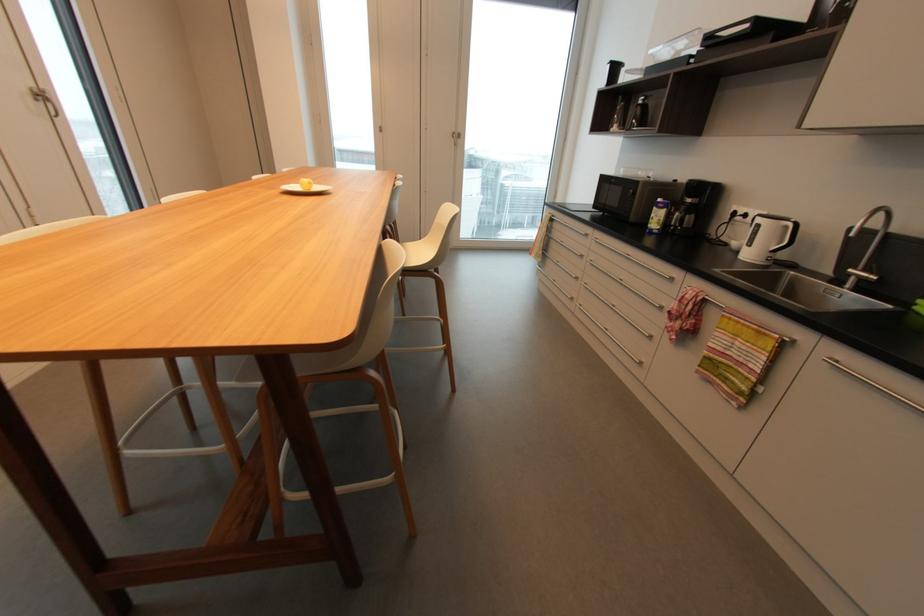
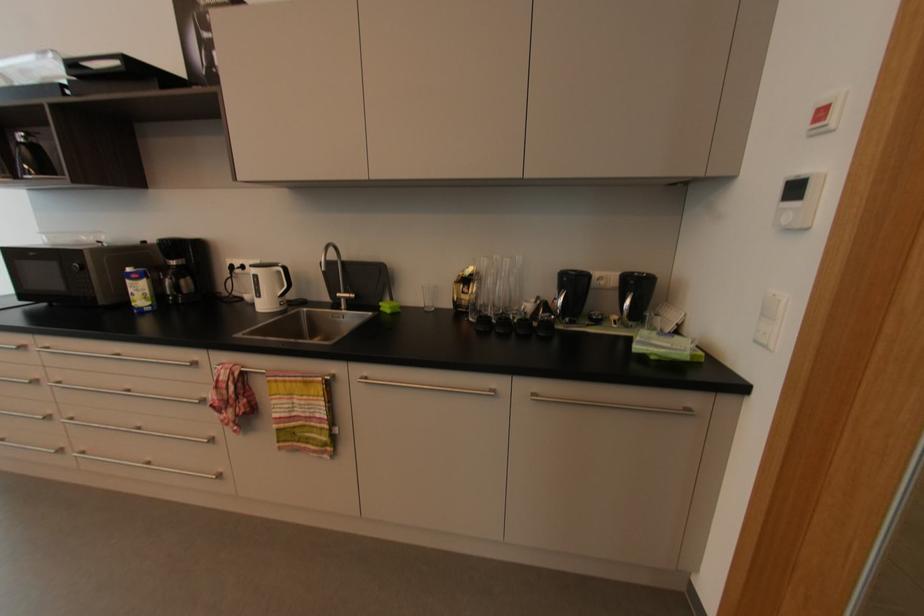
Question: The camera is either moving clockwise (left) or counter-clockwise (right) around the object. The first image is from the beginning of the video and the second image is from the end. Is the camera moving left or right when shooting the video?

Choices:
 (A) Left
 (B) Right

Answer: (A)